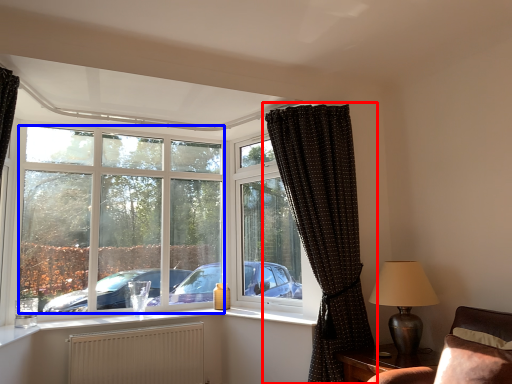
Question: Which object appears closest to the camera in this image, curtain (highlighted by a red box) or bay window (highlighted by a blue box)?

Choices:
 (A) curtain
 (B) bay window

Answer: (A)